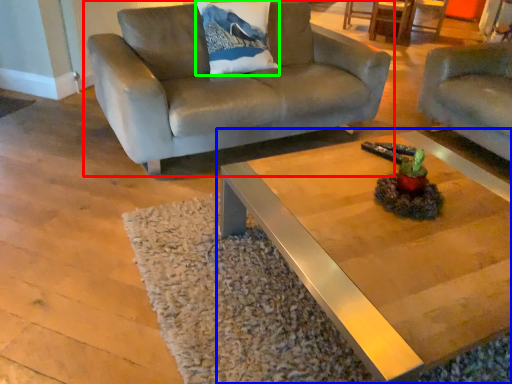
Question: Which object is the farthest from studio couch (highlighted by a red box)? Choose among these: coffee table (highlighted by a blue box) or pillow (highlighted by a green box).

Choices:
 (A) coffee table
 (B) pillow

Answer: (A)